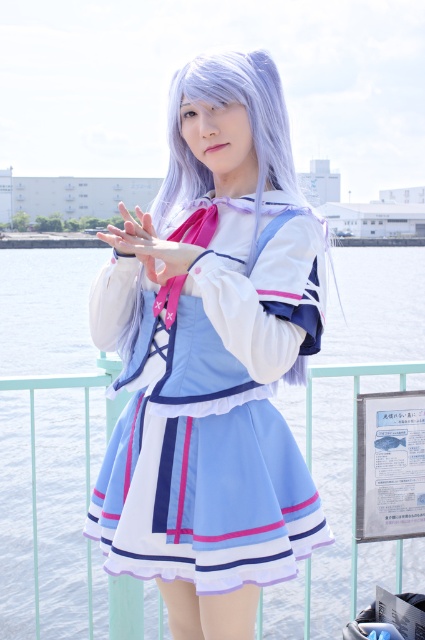
You are a photographer trying to capture both the satin blue dress at center and the light blue fabric dress at center in a single shot. Since the dresses are different in size, which one should you focus on to ensure both are visible without cropping either?

To ensure both the satin blue dress at center and the light blue fabric dress at center are visible without cropping, focus on the satin blue dress at center since it is smaller and requires less space, allowing the larger light blue fabric dress at center to fit alongside.

You are organizing a fashion show and need to arrange two dresses from the image. The satin blue dress at center and the light blue fabric dress at center must be displayed side by side. Which dress should be placed on the lower shelf to ensure proper visibility of both?

The satin blue dress at center should be placed on the lower shelf because it has a lesser height compared to the light blue fabric dress at center, allowing both to be visible when displayed side by side.

You are an artist trying to sketch the scene. You need to place the satin blue dress at center in your drawing. Where should you position it?

The satin blue dress at center should be placed at the coordinates 0.559 on the x axis and 0.499 on the y axis.